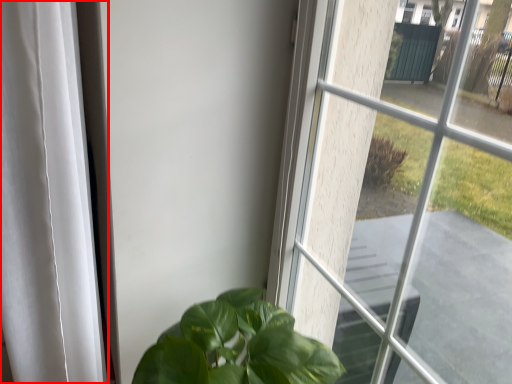
Question: From the image's perspective, considering the relative positions of curtain (annotated by the red box) and window in the image provided, where is curtain (annotated by the red box) located with respect to the staircase?

Choices:
 (A) below
 (B) above

Answer: (A)